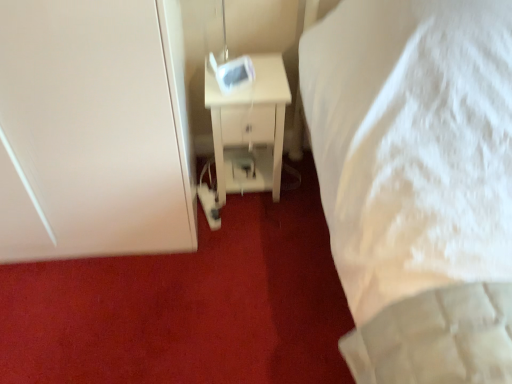
Question: Which is correct: white matte door at left is inside white glossy nightstand at center, or outside of it?

Choices:
 (A) inside
 (B) outside

Answer: (B)

Question: From the image's perspective, is white matte door at left positioned above or below white glossy nightstand at center?

Choices:
 (A) above
 (B) below

Answer: (A)

Question: In the image, is white matte door at left positioned in front of or behind white glossy nightstand at center?

Choices:
 (A) behind
 (B) front

Answer: (B)

Question: Considering the positions of white glossy nightstand at center and white matte door at left in the image, is white glossy nightstand at center wider or thinner than white matte door at left?

Choices:
 (A) thin
 (B) wide

Answer: (A)

Question: Visually, is white glossy nightstand at center positioned to the left or to the right of white matte door at left?

Choices:
 (A) left
 (B) right

Answer: (B)

Question: In terms of size, does white glossy nightstand at center appear bigger or smaller than white matte door at left?

Choices:
 (A) small
 (B) big

Answer: (A)

Question: In terms of height, does white glossy nightstand at center look taller or shorter compared to white matte door at left?

Choices:
 (A) tall
 (B) short

Answer: (B)